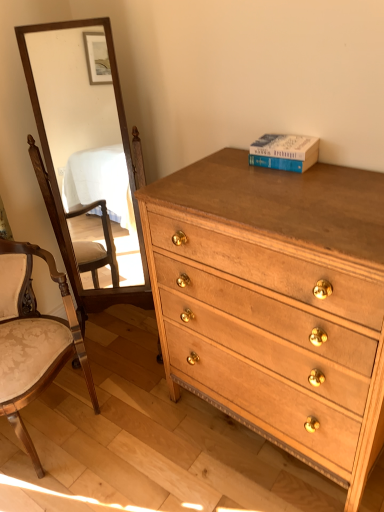
Locate an element on the screen. vacant point above light brown wood chest of drawers at center (from a real-world perspective) is located at coordinates (290, 192).